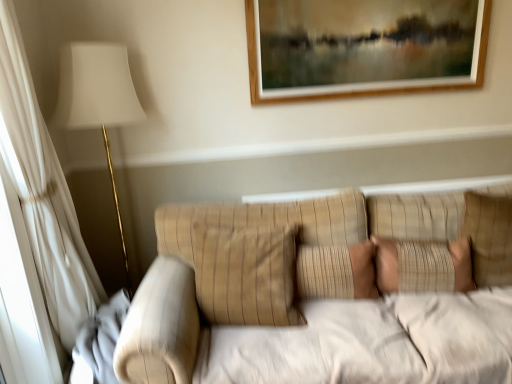
The width and height of the screenshot is (512, 384). What are the coordinates of `beige striped pillow at center, the first pillow positioned from the left` in the screenshot? It's located at (247, 275).

What do you see at coordinates (247, 275) in the screenshot? The image size is (512, 384). I see `beige striped pillow at center, the first pillow positioned from the left` at bounding box center [247, 275].

The height and width of the screenshot is (384, 512). What are the coordinates of `beige textured pillow at right, which is counted as the 1th pillow, starting from the right` in the screenshot? It's located at (488, 237).

You are a GUI agent. You are given a task and a screenshot of the screen. Output one action in this format:
    pyautogui.click(x=<x>, y=<y>)
    Task: Click on the beige textured pillow at center, which is counted as the 2th pillow, starting from the right
    The image size is (512, 384).
    Given the screenshot: What is the action you would take?
    pyautogui.click(x=336, y=272)

Identify the location of beige striped pillow at center, the first pillow positioned from the left. The image size is (512, 384). [247, 275].

From the image's perspective, is beige striped pillow at center, the first pillow positioned from the left, below beige textured pillow at right, which is counted as the 1th pillow, starting from the right?

Indeed, from the image's perspective, beige striped pillow at center, the first pillow positioned from the left, is shown beneath beige textured pillow at right, which is counted as the 1th pillow, starting from the right.

Is beige striped pillow at center, the first pillow positioned from the left, smaller than beige textured pillow at right, which is counted as the 1th pillow, starting from the right?

No, beige striped pillow at center, the first pillow positioned from the left, is not smaller than beige textured pillow at right, which is counted as the 1th pillow, starting from the right.

Which object is wider, beige striped pillow at center, positioned as the third pillow in right-to-left order, or beige textured pillow at right, which is counted as the 1th pillow, starting from the right?

With larger width is beige striped pillow at center, positioned as the third pillow in right-to-left order.

Which point is more forward, (362,269) or (293,286)?

Point (293,286)

In the scene shown: How different are the orientations of beige textured pillow at center, arranged as the second pillow when viewed from the left, and beige striped pillow at center, the first pillow positioned from the left, in degrees?

They differ by 1.22 degrees in their facing directions.

How distant is beige textured pillow at center, which is counted as the 2th pillow, starting from the right, from beige striped pillow at center, positioned as the third pillow in right-to-left order?

A distance of 9.63 inches exists between beige textured pillow at center, which is counted as the 2th pillow, starting from the right, and beige striped pillow at center, positioned as the third pillow in right-to-left order.

From a real-world perspective, does beige textured pillow at center, which is counted as the 2th pillow, starting from the right, sit lower than beige striped pillow at center, positioned as the third pillow in right-to-left order?

Yes, from a real-world perspective, beige textured pillow at center, which is counted as the 2th pillow, starting from the right, is under beige striped pillow at center, positioned as the third pillow in right-to-left order.

Can you confirm if beige textured pillow at right, which is counted as the 1th pillow, starting from the right, is positioned to the left of beige striped pillow at center, positioned as the third pillow in right-to-left order?

Incorrect, beige textured pillow at right, which is counted as the 1th pillow, starting from the right, is not on the left side of beige striped pillow at center, positioned as the third pillow in right-to-left order.

From the image's perspective, would you say beige textured pillow at right, acting as the 3th pillow starting from the left, is positioned over beige striped pillow at center, the first pillow positioned from the left?

Yes, from the image's perspective, beige textured pillow at right, acting as the 3th pillow starting from the left, is above beige striped pillow at center, the first pillow positioned from the left.

Is beige textured pillow at right, which is counted as the 1th pillow, starting from the right, in front of or behind beige striped pillow at center, positioned as the third pillow in right-to-left order, in the image?

beige textured pillow at right, which is counted as the 1th pillow, starting from the right, is positioned farther from the viewer than beige striped pillow at center, positioned as the third pillow in right-to-left order.

Is beige textured pillow at right, which is counted as the 1th pillow, starting from the right, smaller than beige striped pillow at center, positioned as the third pillow in right-to-left order?

Yes, beige textured pillow at right, which is counted as the 1th pillow, starting from the right, is smaller than beige striped pillow at center, positioned as the third pillow in right-to-left order.

From the image's perspective, would you say beige textured pillow at center, which is counted as the 2th pillow, starting from the right, is positioned over beige textured pillow at right, which is counted as the 1th pillow, starting from the right?

Actually, beige textured pillow at center, which is counted as the 2th pillow, starting from the right, appears below beige textured pillow at right, which is counted as the 1th pillow, starting from the right, in the image.

Consider the image. Considering the sizes of beige textured pillow at center, which is counted as the 2th pillow, starting from the right, and beige textured pillow at right, which is counted as the 1th pillow, starting from the right, in the image, is beige textured pillow at center, which is counted as the 2th pillow, starting from the right, taller or shorter than beige textured pillow at right, which is counted as the 1th pillow, starting from the right,?

Clearly, beige textured pillow at center, which is counted as the 2th pillow, starting from the right, is shorter compared to beige textured pillow at right, which is counted as the 1th pillow, starting from the right.

From a real-world perspective, is beige textured pillow at center, which is counted as the 2th pillow, starting from the right, under beige textured pillow at right, acting as the 3th pillow starting from the left?

Yes, from a real-world perspective, beige textured pillow at center, which is counted as the 2th pillow, starting from the right, is below beige textured pillow at right, acting as the 3th pillow starting from the left.

Is beige textured pillow at center, arranged as the second pillow when viewed from the left, in contact with beige textured pillow at right, which is counted as the 1th pillow, starting from the right?

beige textured pillow at center, arranged as the second pillow when viewed from the left, is not next to beige textured pillow at right, which is counted as the 1th pillow, starting from the right, and they're not touching.

Considering the points (509, 269) and (351, 271), which point is in front, point (509, 269) or point (351, 271)?

The point (351, 271) is more forward.

In the scene shown: How different are the orientations of beige textured pillow at right, which is counted as the 1th pillow, starting from the right, and beige textured pillow at center, which is counted as the 2th pillow, starting from the right, in degrees?

The angular difference between beige textured pillow at right, which is counted as the 1th pillow, starting from the right, and beige textured pillow at center, which is counted as the 2th pillow, starting from the right, is 3.3 degrees.

In the image, is beige textured pillow at right, acting as the 3th pillow starting from the left, on the left side or the right side of beige textured pillow at center, which is counted as the 2th pillow, starting from the right?

From the image, it's evident that beige textured pillow at right, acting as the 3th pillow starting from the left, is to the right of beige textured pillow at center, which is counted as the 2th pillow, starting from the right.

Based on the photo, considering the relative sizes of beige textured pillow at right, acting as the 3th pillow starting from the left, and beige textured pillow at center, arranged as the second pillow when viewed from the left, in the image provided, is beige textured pillow at right, acting as the 3th pillow starting from the left, thinner than beige textured pillow at center, arranged as the second pillow when viewed from the left,?

Incorrect, the width of beige textured pillow at right, acting as the 3th pillow starting from the left, is not less than that of beige textured pillow at center, arranged as the second pillow when viewed from the left.

From a real-world perspective, is beige striped pillow at center, positioned as the third pillow in right-to-left order, above or below beige textured pillow at center, which is counted as the 2th pillow, starting from the right?

beige striped pillow at center, positioned as the third pillow in right-to-left order, is above beige textured pillow at center, which is counted as the 2th pillow, starting from the right.

Considering the sizes of objects beige striped pillow at center, positioned as the third pillow in right-to-left order, and beige textured pillow at center, which is counted as the 2th pillow, starting from the right, in the image provided, who is bigger, beige striped pillow at center, positioned as the third pillow in right-to-left order, or beige textured pillow at center, which is counted as the 2th pillow, starting from the right,?

With larger size is beige striped pillow at center, positioned as the third pillow in right-to-left order.

In the scene shown: Between beige striped pillow at center, positioned as the third pillow in right-to-left order, and beige textured pillow at center, which is counted as the 2th pillow, starting from the right, which one is positioned in front?

beige striped pillow at center, positioned as the third pillow in right-to-left order, is more forward.

Is beige striped pillow at center, the first pillow positioned from the left, positioned beyond the bounds of beige textured pillow at center, which is counted as the 2th pillow, starting from the right?

Absolutely, beige striped pillow at center, the first pillow positioned from the left, is external to beige textured pillow at center, which is counted as the 2th pillow, starting from the right.

This screenshot has height=384, width=512. Identify the location of pillow that is the 1st one below the beige textured pillow at right, acting as the 3th pillow starting from the left (from a real-world perspective). (247, 275).

Identify the location of the 1st pillow above when counting from the beige textured pillow at center, arranged as the second pillow when viewed from the left (from the image's perspective). This screenshot has height=384, width=512. pyautogui.click(x=247, y=275).

Based on their spatial positions, is beige textured pillow at center, which is counted as the 2th pillow, starting from the right, or beige textured pillow at right, which is counted as the 1th pillow, starting from the right, further from beige striped pillow at center, positioned as the third pillow in right-to-left order?

beige textured pillow at right, which is counted as the 1th pillow, starting from the right, lies further to beige striped pillow at center, positioned as the third pillow in right-to-left order, than the other object.

Looking at this image, looking at the image, which one is located closer to beige textured pillow at center, arranged as the second pillow when viewed from the left, beige textured pillow at right, acting as the 3th pillow starting from the left, or beige striped pillow at center, positioned as the third pillow in right-to-left order?

beige striped pillow at center, positioned as the third pillow in right-to-left order, is positioned closer to the anchor beige textured pillow at center, arranged as the second pillow when viewed from the left.

Considering their positions, is beige textured pillow at center, arranged as the second pillow when viewed from the left, positioned further to beige textured pillow at right, which is counted as the 1th pillow, starting from the right, than beige striped pillow at center, the first pillow positioned from the left?

beige striped pillow at center, the first pillow positioned from the left.

Looking at this image, considering their positions, is beige textured pillow at right, acting as the 3th pillow starting from the left, positioned closer to beige striped pillow at center, positioned as the third pillow in right-to-left order, than beige textured pillow at center, arranged as the second pillow when viewed from the left?

beige textured pillow at center, arranged as the second pillow when viewed from the left, is closer to beige striped pillow at center, positioned as the third pillow in right-to-left order.

From the image, which object appears to be nearer to beige textured pillow at center, arranged as the second pillow when viewed from the left, beige striped pillow at center, positioned as the third pillow in right-to-left order, or beige textured pillow at right, acting as the 3th pillow starting from the left?

beige striped pillow at center, positioned as the third pillow in right-to-left order.

Looking at the image, which one is located further to beige textured pillow at right, which is counted as the 1th pillow, starting from the right, beige striped pillow at center, the first pillow positioned from the left, or beige textured pillow at center, arranged as the second pillow when viewed from the left?

beige striped pillow at center, the first pillow positioned from the left, is further to beige textured pillow at right, which is counted as the 1th pillow, starting from the right.

Identify the location of pillow between beige striped pillow at center, positioned as the third pillow in right-to-left order, and beige textured pillow at right, which is counted as the 1th pillow, starting from the right. The image size is (512, 384). (336, 272).